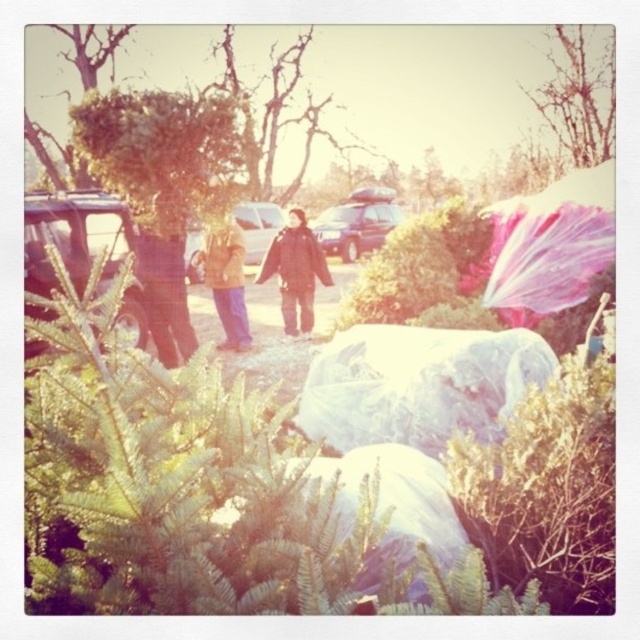
You are planning to take a photo of the matte brown car at center and the bare branches at upper right. Which object should you focus on first if you want to capture both in a single frame without moving the camera?

The bare branches at upper right is larger in size than the matte brown car at center, so you should focus on the bare branches at upper right first to ensure it fits well in the frame.

You are at a Christmas tree lot and need to carry some decorations. You have a transparent plastic bag at center and a metallic silver car at left. Which item can hold more items based on their sizes?

The metallic silver car at left can hold more items since it is larger than the transparent plastic bag at center.

What is the location of the metallic silver car at left in the image coordinate system?

The metallic silver car at left is located at point coordinates of (74, 236).